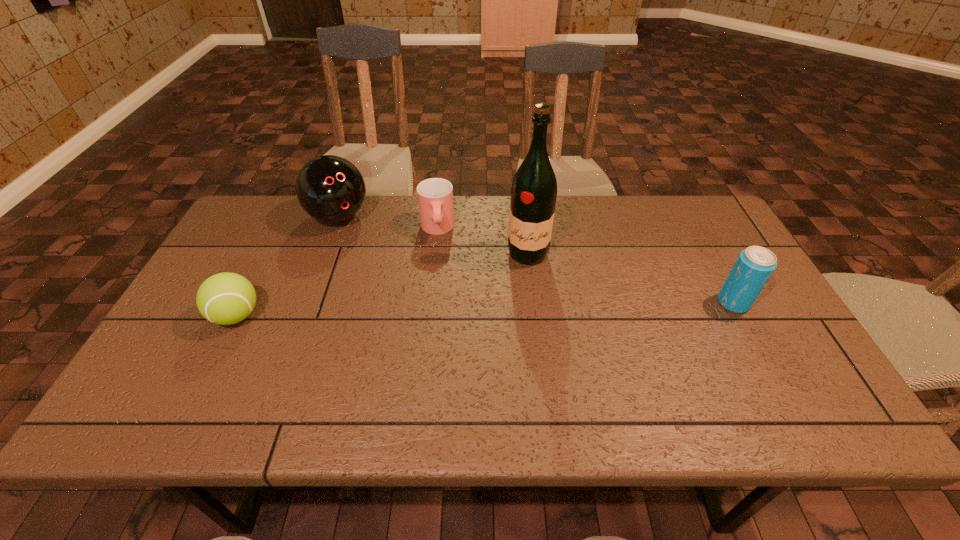
Locate an element on the screen. The image size is (960, 540). the leftmost object is located at coordinates (226, 298).

This screenshot has height=540, width=960. In order to click on the third shortest object in this screenshot , I will do `click(754, 266)`.

Image resolution: width=960 pixels, height=540 pixels. Find the location of `the rightmost object`. the rightmost object is located at coordinates click(754, 266).

In order to click on the tallest object in this screenshot , I will do `click(534, 189)`.

Locate an element on the screen. liquor is located at coordinates (534, 189).

The height and width of the screenshot is (540, 960). Identify the location of cup. (435, 195).

Image resolution: width=960 pixels, height=540 pixels. I want to click on bowling ball, so click(331, 189).

The width and height of the screenshot is (960, 540). Find the location of `the second object from left to right`. the second object from left to right is located at coordinates (331, 189).

Where is `vacant region located on the back of the tennis ball`? The width and height of the screenshot is (960, 540). vacant region located on the back of the tennis ball is located at coordinates (277, 237).

Where is `free space located on the left of the third tallest object`? This screenshot has height=540, width=960. free space located on the left of the third tallest object is located at coordinates (660, 302).